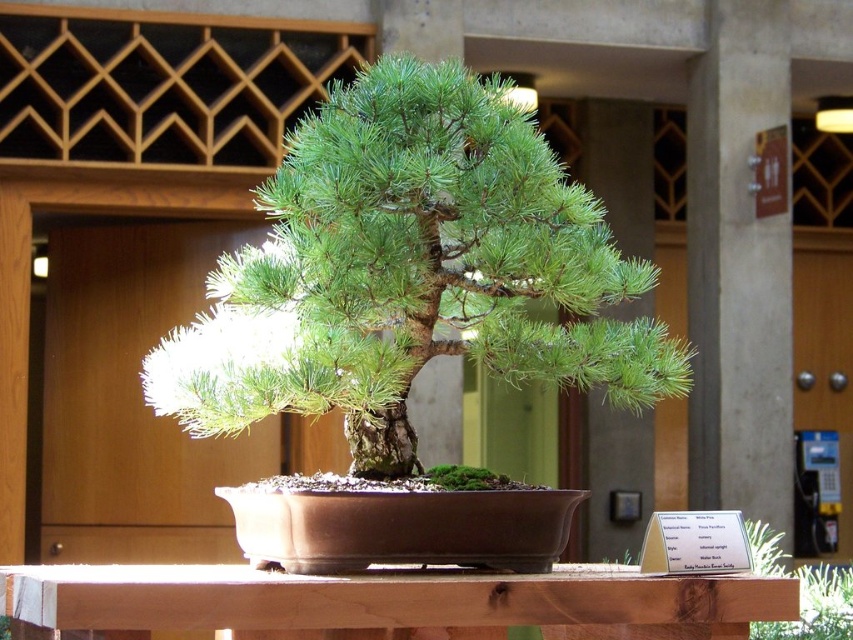
You are arranging a small decorative item on the brown wood table at center. You want to place it so that it is to the left of the green matte bonsai tree at center. Where should you place it on the table?

The green matte bonsai tree at center is to the right of the brown wood table at center, so placing the decorative item to the left of the green matte bonsai tree at center would mean positioning it on the left side of the table.

You are a gardener who wants to move the green matte bonsai tree at center to a larger pot. The current brown wood table at center can only accommodate items up to its own size. Can the bonsai tree currently fit on the table?

The green matte bonsai tree at center is larger in size than the brown wood table at center, so it cannot fit on the table.

You are standing in front of the bonsai tree on the wooden table. There are two points marked on the table surface. One is at coordinates point [228,330] and the other is at point [761,577]. Which point is closer to you?

Point [228,330] is closer to you because it is further to the camera than point [761,577].